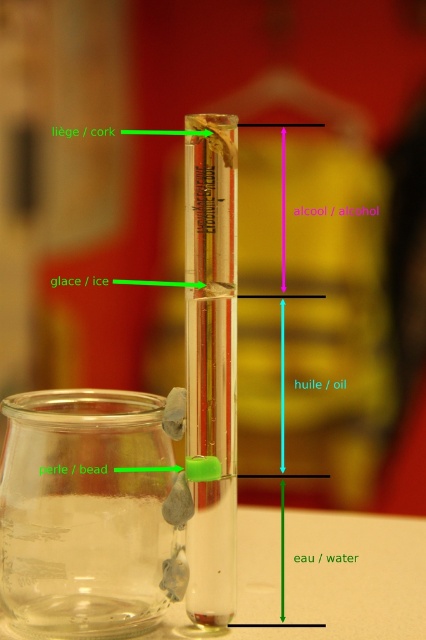
Can you confirm if transparent glass jar at lower left is thinner than transparent glass beaker at center?

No, transparent glass jar at lower left is not thinner than transparent glass beaker at center.

Looking at this image, can you confirm if transparent glass jar at lower left is wider than transparent glass beaker at center?

Indeed, transparent glass jar at lower left has a greater width compared to transparent glass beaker at center.

Between point (88, 388) and point (210, 268), which one is positioned in front?

Point (210, 268) is more forward.

The image size is (426, 640). Identify the location of transparent glass jar at lower left. (86, 515).